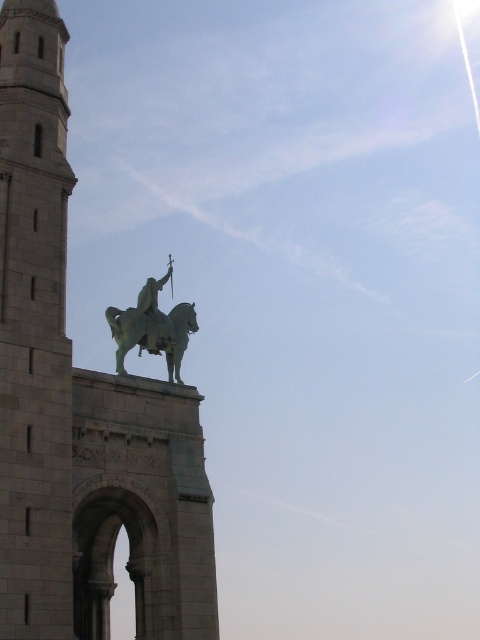
You are an architect analyzing the spatial arrangement of the monument. Which object, the gray stone tower at upper left or the green polished metal statue at upper center, is positioned higher in the scene?

The gray stone tower at upper left is positioned higher than the green polished metal statue at upper center according to the description.

You are standing in front of the monument and want to take a photo that includes both the point at coordinates point (0,413) and point (51,246). To ensure both points are visible in the frame, which point should you position closer to the camera?

You should position the camera closer to point (0,413) because it is in front of point (51,246), so keeping it closer to the camera will help both points remain in the frame.